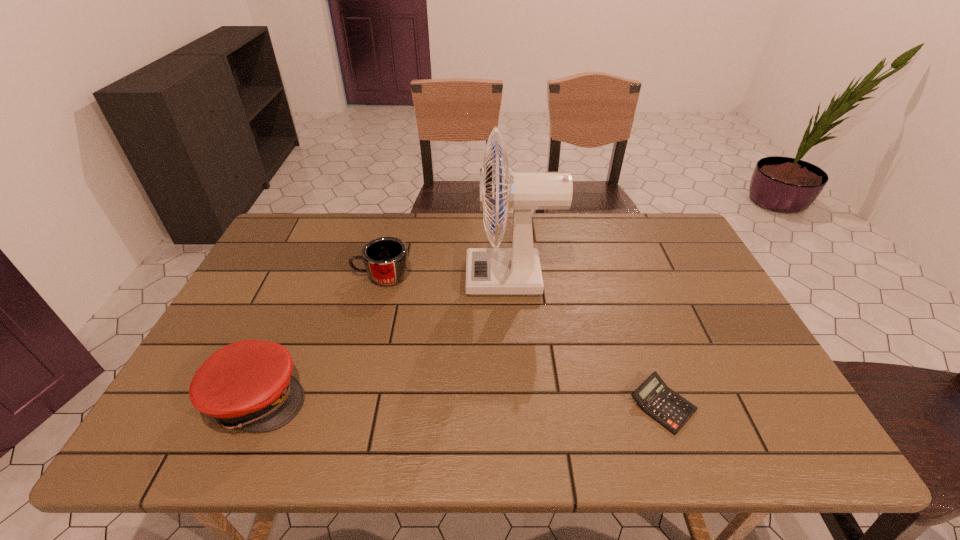
Where is `empty location between the mug and the leftmost object`? empty location between the mug and the leftmost object is located at coordinates (320, 337).

I want to click on unoccupied position between the mug and the shortest object, so click(522, 341).

Identify the location of vacant area that lies between the mug and the rightmost object. (522, 341).

Where is `vacant region between the third object from left to right and the mug`? vacant region between the third object from left to right and the mug is located at coordinates coord(446,277).

You are a GUI agent. You are given a task and a screenshot of the screen. Output one action in this format:
    pyautogui.click(x=<x>, y=<y>)
    Task: Click on the free area in between the rightmost object and the leftmost object
    The width and height of the screenshot is (960, 540).
    Given the screenshot: What is the action you would take?
    pyautogui.click(x=460, y=401)

Identify the location of free spot between the third object from left to right and the rightmost object. (587, 341).

Image resolution: width=960 pixels, height=540 pixels. Find the location of `the closest object to the mug`. the closest object to the mug is located at coordinates (489, 271).

You are a GUI agent. You are given a task and a screenshot of the screen. Output one action in this format:
    pyautogui.click(x=<x>, y=<y>)
    Task: Click on the object that is the second closest one to the leftmost object
    
    Given the screenshot: What is the action you would take?
    pyautogui.click(x=489, y=271)

This screenshot has width=960, height=540. In order to click on vacant point that satisfies the following two spatial constraints: 1. on the front-facing side of the shortest object; 2. on the right side of the second object from right to left in this screenshot , I will do `click(522, 405)`.

Find the location of `blank area in the image that satisfies the following two spatial constraints: 1. on the front of the rightmost object with an emblem; 2. on the right side of the cap`. blank area in the image that satisfies the following two spatial constraints: 1. on the front of the rightmost object with an emblem; 2. on the right side of the cap is located at coordinates (254, 405).